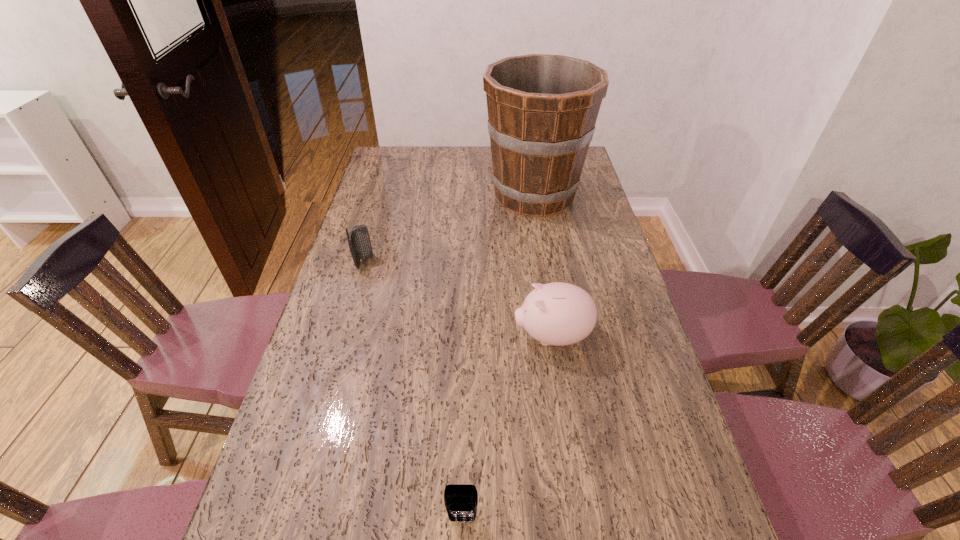
In order to click on the tallest object in this screenshot , I will do `click(542, 109)`.

What are the coordinates of `the farthest object` in the screenshot? It's located at (542, 109).

You are a GUI agent. You are given a task and a screenshot of the screen. Output one action in this format:
    pyautogui.click(x=<x>, y=<y>)
    Task: Click on the second nearest object
    The height and width of the screenshot is (540, 960).
    Given the screenshot: What is the action you would take?
    pyautogui.click(x=559, y=314)

This screenshot has width=960, height=540. In order to click on the farther cellular telephone in this screenshot , I will do [x=359, y=242].

In order to click on the left cellular telephone in this screenshot , I will do `click(359, 242)`.

Where is `the shorter cellular telephone`? This screenshot has height=540, width=960. the shorter cellular telephone is located at coordinates (461, 500).

Where is `the second object from left to right`? This screenshot has width=960, height=540. the second object from left to right is located at coordinates (461, 500).

Locate an element on the screen. The width and height of the screenshot is (960, 540). free space located on the back of the bucket is located at coordinates (528, 157).

Find the location of a particular element. Image resolution: width=960 pixels, height=540 pixels. vacant space located 0.130m at the snout of the piggy bank is located at coordinates (465, 336).

Identify the location of free location located 0.390m at the snout of the piggy bank. (370, 336).